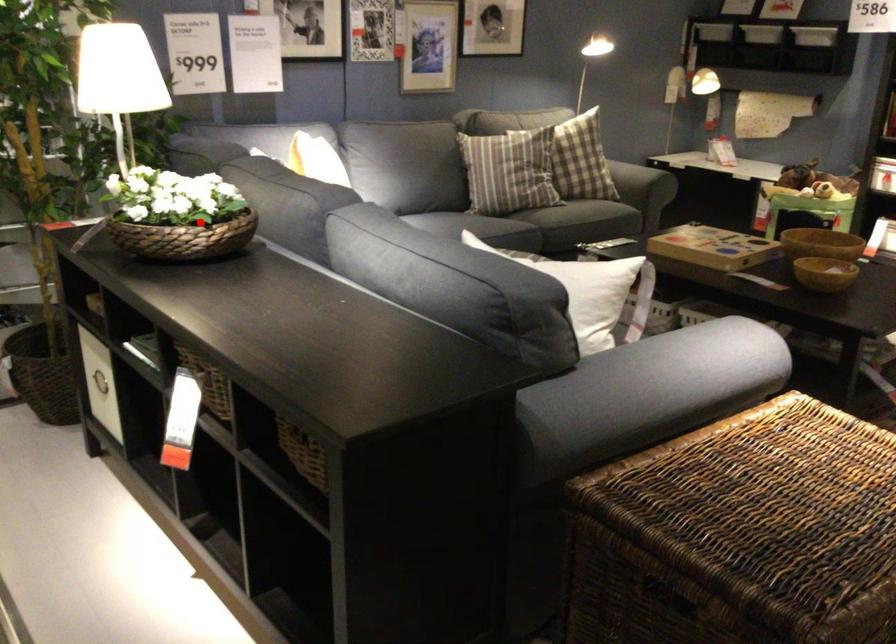
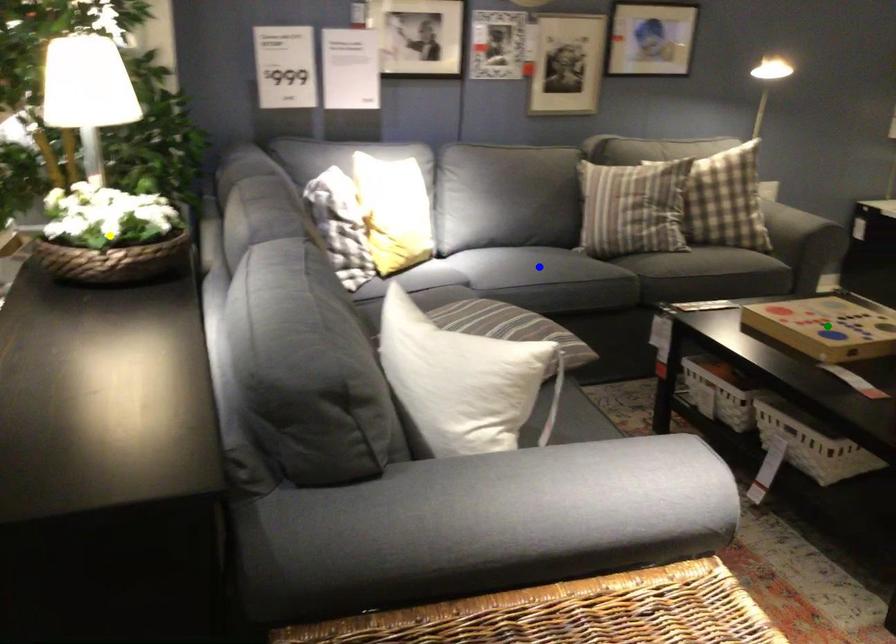
Question: I am providing you with two images of the same scene from different viewpoints. A red point is marked on the first image. You are given multiple points on the second image. Which point in image 2 is actually the same real-world point as the red point in image 1?

Choices:
 (A) green point
 (B) yellow point
 (C) blue point

Answer: (B)